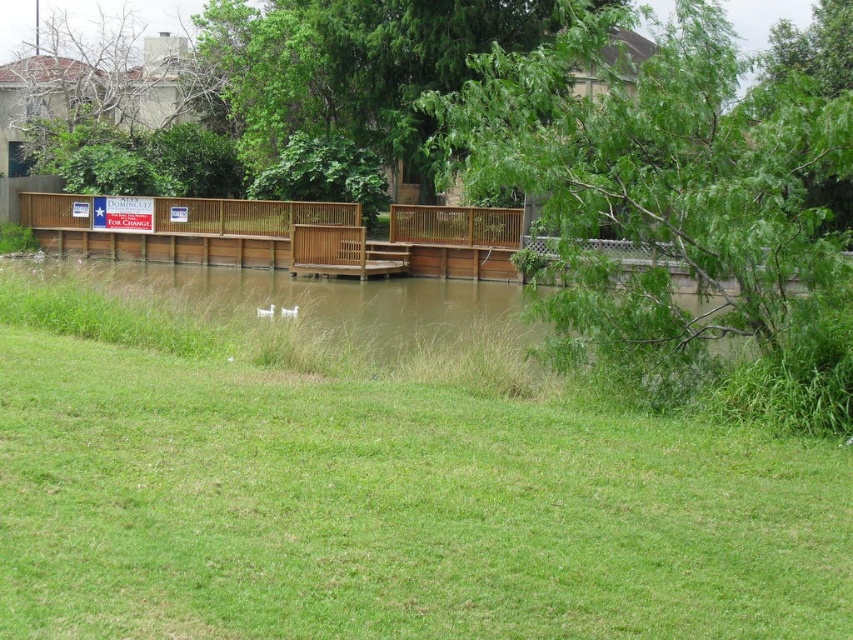
Question: Which object is closer to the camera taking this photo?

Choices:
 (A) green leafy tree at upper right
 (B) green grass at center
 (C) green leafy tree at upper center

Answer: (B)

Question: Is green leafy tree at upper right positioned at the back of green leafy tree at upper center?

Choices:
 (A) no
 (B) yes

Answer: (A)

Question: Is green grass at center below green leafy tree at upper right?

Choices:
 (A) yes
 (B) no

Answer: (A)

Question: Estimate the real-world distances between objects in this image. Which object is closer to the green leafy tree at upper center?

Choices:
 (A) green leafy tree at upper right
 (B) green grass at center

Answer: (A)

Question: Does green grass at center have a larger size compared to green leafy tree at upper right?

Choices:
 (A) yes
 (B) no

Answer: (B)

Question: Considering the real-world distances, which object is farthest from the green leafy tree at upper right?

Choices:
 (A) green leafy tree at upper center
 (B) green grass at center

Answer: (A)